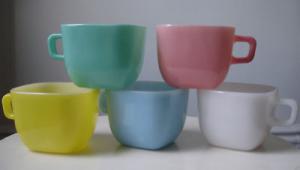
The width and height of the screenshot is (300, 170). What are the coordinates of `cups` in the screenshot? It's located at (100, 27), (63, 113), (144, 113), (197, 59), (219, 113).